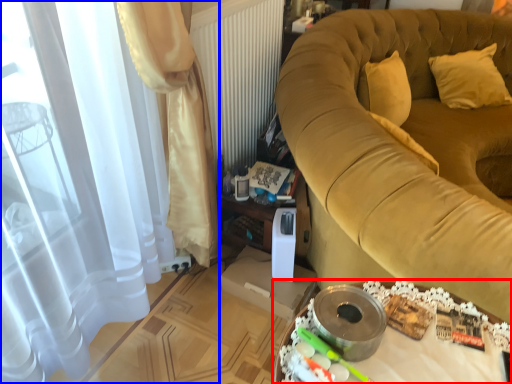
Question: Which object appears farthest to the camera in this image, table (highlighted by a red box) or curtain (highlighted by a blue box)?

Choices:
 (A) table
 (B) curtain

Answer: (B)